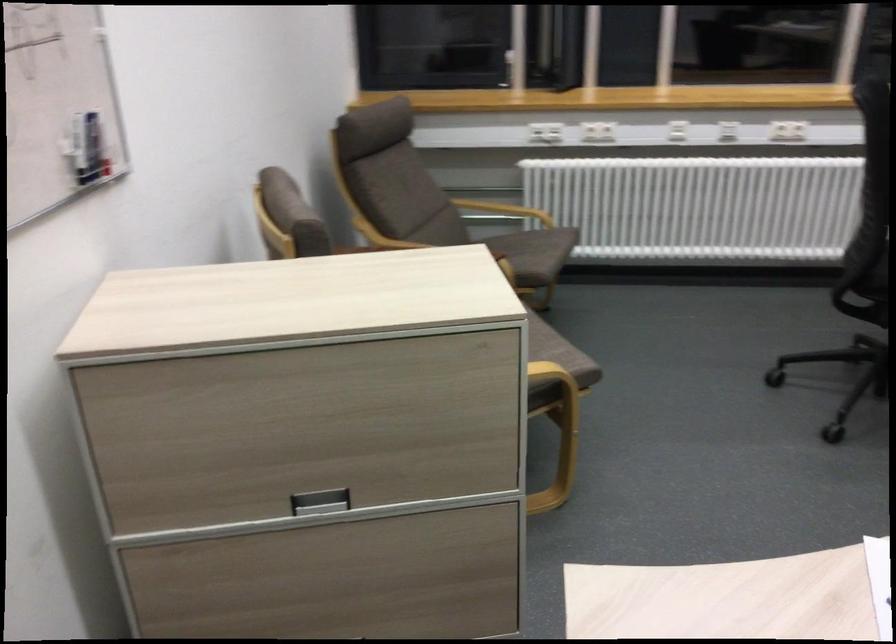
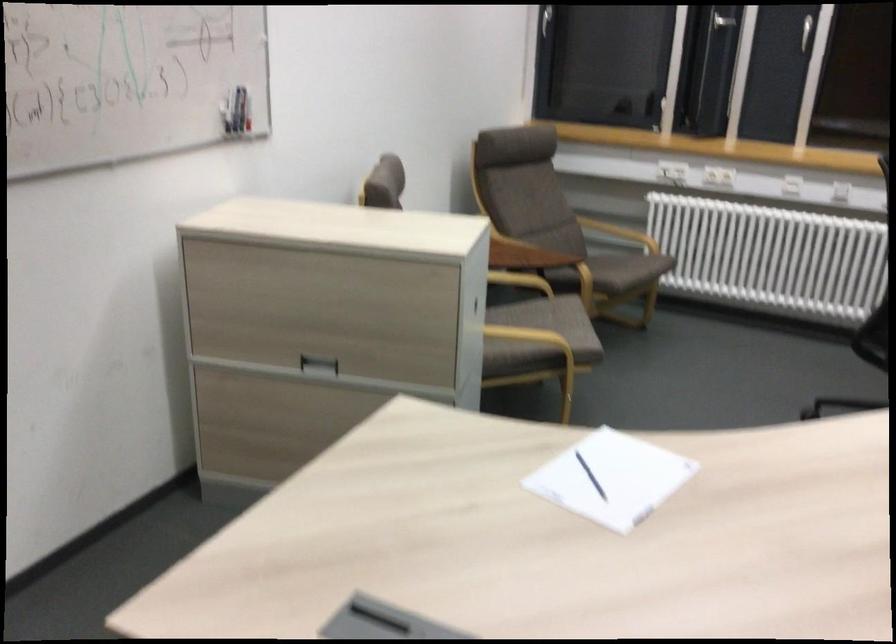
In the second image, find the point that corresponds to [72,155] in the first image.

(228, 111)